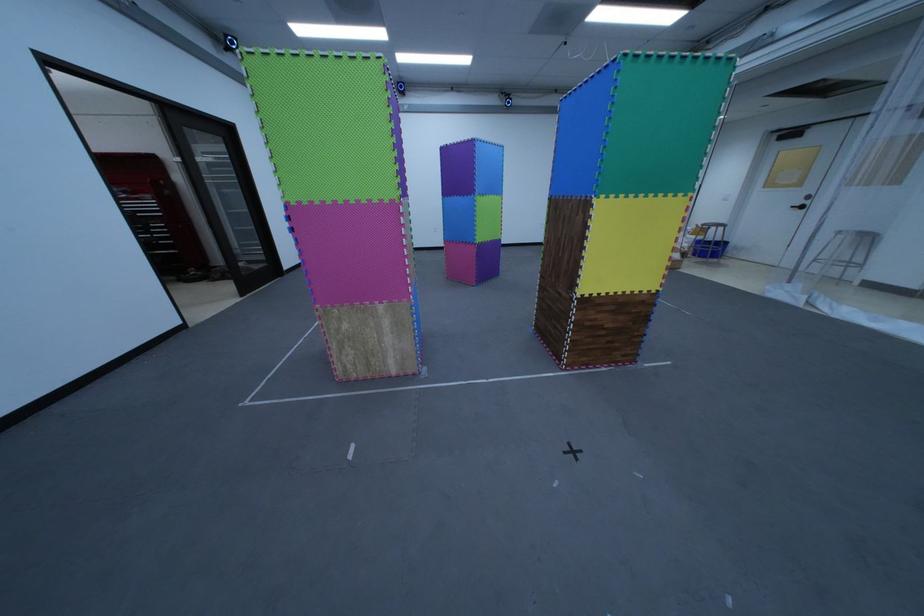
The height and width of the screenshot is (616, 924). What do you see at coordinates (797, 207) in the screenshot?
I see `the black door handle` at bounding box center [797, 207].